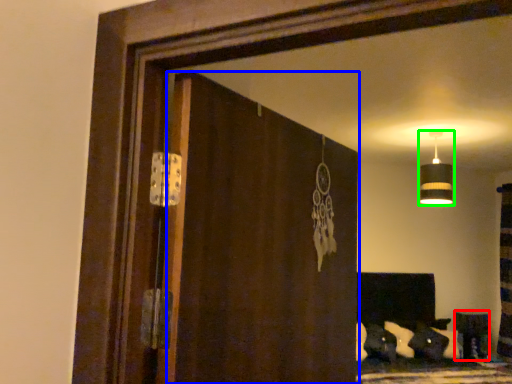
Question: Which object is the closest to the furniture (highlighted by a red box)? Choose among these: screen door (highlighted by a blue box) or lamp (highlighted by a green box).

Choices:
 (A) screen door
 (B) lamp

Answer: (B)